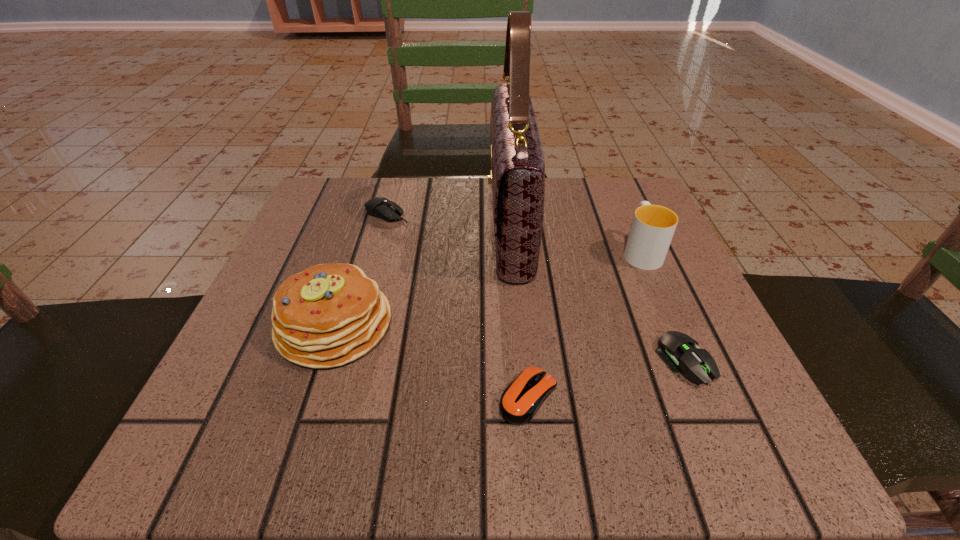
Choose which object is the fourth nearest neighbor to the rightmost computer mouse. Please provide its 2D coordinates. Your answer should be formatted as a tuple, i.e. [(x, y)], where the tuple contains the x and y coordinates of a point satisfying the conditions above.

[(328, 315)]

Image resolution: width=960 pixels, height=540 pixels. What are the coordinates of `object that is the third closest to the second computer mouse from left to right` in the screenshot? It's located at (517, 176).

The image size is (960, 540). Identify the location of the closest computer mouse relative to the cup. (675, 348).

The width and height of the screenshot is (960, 540). In order to click on the second closest computer mouse to the second computer mouse from right to left in this screenshot , I will do `click(383, 208)`.

Where is `free space that satisfies the following two spatial constraints: 1. on the front of the handbag with the clasp; 2. on the back side of the second computer mouse from right to left`? The image size is (960, 540). free space that satisfies the following two spatial constraints: 1. on the front of the handbag with the clasp; 2. on the back side of the second computer mouse from right to left is located at coordinates (525, 396).

The width and height of the screenshot is (960, 540). What are the coordinates of `vacant space that satisfies the following two spatial constraints: 1. on the front of the tallest object with the clasp; 2. with the handle on the side of the cup` in the screenshot? It's located at (513, 251).

In order to click on free space that satisfies the following two spatial constraints: 1. on the front side of the pancake; 2. on the left side of the second computer mouse from right to left in this screenshot , I will do pos(311,396).